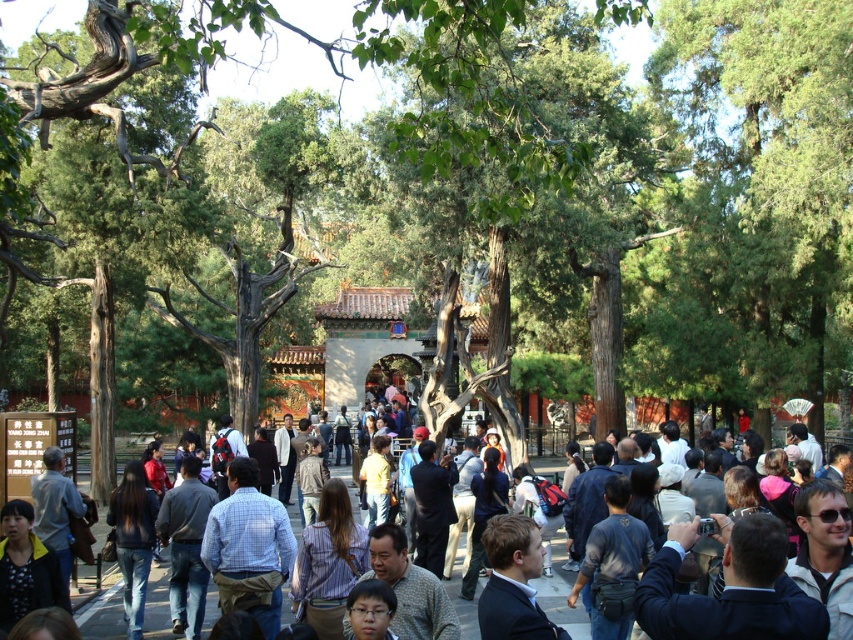
You are a photographer positioned at the lower left corner of the scene. You want to capture a photo of the multicolored casual clothing at center while also including the dark blue jeans at lower left in the frame. Which direction should you move to ensure both are visible?

Since the multicolored casual clothing at center is to the right of dark blue jeans at lower left, you should move to the left to include both in the frame.

You are a photographer trying to capture a photo of the striped shirt at center without the multicolored casual clothing at center appearing in the foreground. Is this possible based on their positions?

The multicolored casual clothing at center is positioned under the striped shirt at center, meaning the striped shirt is above it. Therefore, adjusting the camera angle to look upward might allow capturing the striped shirt without the multicolored casual clothing in the foreground.

You are a tour guide leading a group through the historical site. You notice two visitors wearing multicolored casual clothing at center and striped shirt at center. If you want to ensure that both visitors can hear you clearly, what is the maximum distance you should stand from each of them?

The distance between multicolored casual clothing at center and striped shirt at center is 8.89 meters. To ensure both visitors can hear you clearly, you should stand no more than 4.445 meters away from each of them.